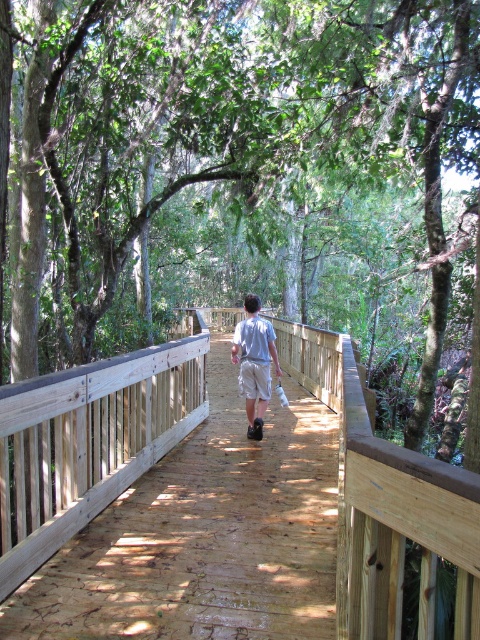
Between light gray cotton shirt at center and tan cotton shorts at center, which one is positioned lower?

tan cotton shorts at center

Between point (268, 326) and point (252, 388), which one is positioned in front?

Point (268, 326)

Locate an element on the screen. The height and width of the screenshot is (640, 480). light gray cotton shirt at center is located at coordinates (254, 362).

Between brown wooden bridge at center and tan cotton shorts at center, which one has less height?

With less height is tan cotton shorts at center.

Measure the distance from brown wooden bridge at center to tan cotton shorts at center.

brown wooden bridge at center is 2.62 meters away from tan cotton shorts at center.

Which is behind, point (374, 554) or point (271, 378)?

Point (271, 378)

Image resolution: width=480 pixels, height=640 pixels. What are the coordinates of `brown wooden bridge at center` in the screenshot? It's located at (385, 502).

Measure the distance from brown wooden bridge at center to light gray cotton shirt at center.

The distance of brown wooden bridge at center from light gray cotton shirt at center is 2.63 meters.

Between brown wooden bridge at center and light gray cotton shirt at center, which one has more height?

brown wooden bridge at center is taller.

Is point (127, 387) more distant than point (248, 320)?

No, (127, 387) is in front of (248, 320).

You are a GUI agent. You are given a task and a screenshot of the screen. Output one action in this format:
    pyautogui.click(x=<x>, y=<y>)
    Task: Click on the brown wooden bridge at center
    The height and width of the screenshot is (640, 480).
    Given the screenshot: What is the action you would take?
    pyautogui.click(x=385, y=502)